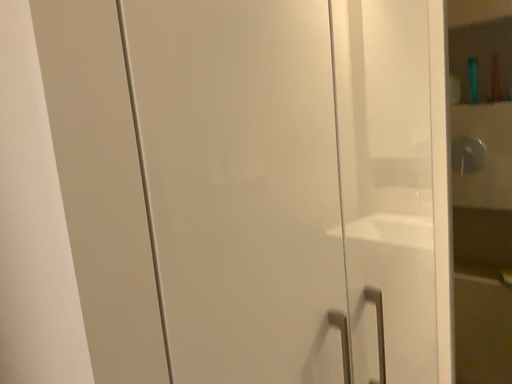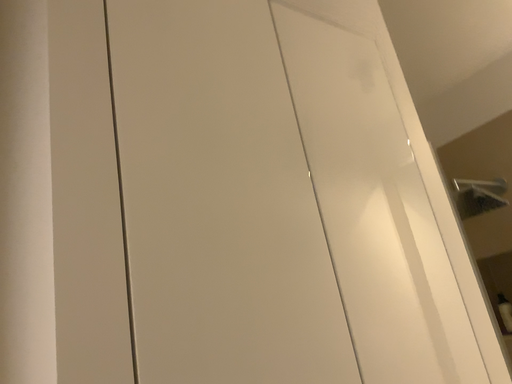
Question: Which way did the camera rotate in the video?

Choices:
 (A) rotated downward
 (B) rotated upward

Answer: (B)